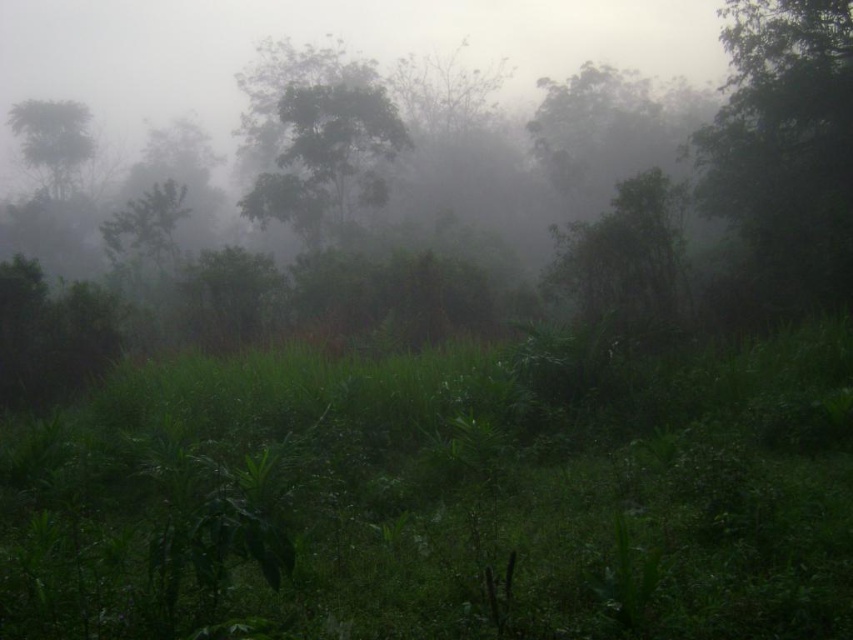
You are navigating through a dense, misty forest. You see two points marked in the image. Which point is closer to you, point (792, 506) or point (801, 284)?

Point (792, 506) is in front of point (801, 284), so it is closer to you.

You are an explorer in the misty forest. You see the green leafy grass at center and the green leafy tree at right. Which object is closer to the left side of your view?

The green leafy grass at center is closer to the left side of your view because it is positioned to the left of the green leafy tree at right.

You are a hiker trying to navigate through the dense forest. You see the green leafy grass at center and the green leafy tree at right. Which object would be easier to walk around?

The green leafy grass at center is thinner than the green leafy tree at right, so it would be easier to walk around the green leafy grass at center.